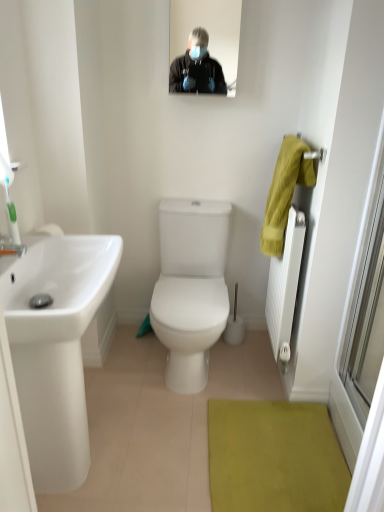
What is the approximate width of white glossy toilet at center?

It is 21.89 inches.

Where is `white glossy toilet at center`? This screenshot has height=512, width=384. white glossy toilet at center is located at coordinates (191, 288).

The width and height of the screenshot is (384, 512). Describe the element at coordinates (204, 46) in the screenshot. I see `matte black mirror at upper center` at that location.

You are a GUI agent. You are given a task and a screenshot of the screen. Output one action in this format:
    pyautogui.click(x=<x>, y=<y>)
    Task: Click on the green textured bath mat at lower center
    The width and height of the screenshot is (384, 512).
    Given the screenshot: What is the action you would take?
    pyautogui.click(x=274, y=457)

Which object is positioned more to the left, transparent glass door at right or white textured radiator at right?

white textured radiator at right.

Which point is more forward, (x=376, y=197) or (x=291, y=315)?

The point (x=376, y=197) is closer.

Can you confirm if transparent glass door at right is wider than white textured radiator at right?

No.

Is point (195, 335) positioned after point (78, 372)?

Yes, it is behind point (78, 372).

From a real-world perspective, does white glossy toilet at center sit lower than white glossy sink at left?

Yes.

Is the surface of white glossy toilet at center in direct contact with white glossy sink at left?

No, white glossy toilet at center is not making contact with white glossy sink at left.

From their relative heights in the image, would you say white glossy toilet at center is taller or shorter than white glossy sink at left?

white glossy toilet at center is shorter than white glossy sink at left.

Which of these two, transparent glass door at right or green textured bath mat at lower center, is wider?

green textured bath mat at lower center is wider.

From the image's perspective, which one is positioned lower, transparent glass door at right or green textured bath mat at lower center?

From the image's view, green textured bath mat at lower center is below.

Does point (373, 214) appear closer or farther from the camera than point (256, 442)?

Clearly, point (373, 214) is closer to the camera than point (256, 442).

From a real-world perspective, is transparent glass door at right positioned above or below green textured bath mat at lower center?

transparent glass door at right is above green textured bath mat at lower center.

From the picture: Is yellow fabric hand towel at right smaller than white glossy sink at left?

Yes.

Would you say yellow fabric hand towel at right is inside or outside white glossy sink at left?

yellow fabric hand towel at right is outside white glossy sink at left.

Considering the relative positions of yellow fabric hand towel at right and white glossy sink at left in the image provided, is yellow fabric hand towel at right to the left of white glossy sink at left from the viewer's perspective?

No.

Looking at their sizes, would you say yellow fabric hand towel at right is wider or thinner than white glossy sink at left?

yellow fabric hand towel at right is thinner than white glossy sink at left.

Is white glossy sink at left positioned beyond the bounds of white glossy toilet at center?

Indeed, white glossy sink at left is completely outside white glossy toilet at center.

Between white glossy sink at left and white glossy toilet at center, which one has more height?

Standing taller between the two is white glossy sink at left.

Is white glossy sink at left aimed at white glossy toilet at center?

No, white glossy sink at left is not turned towards white glossy toilet at center.

Identify the location of sink in front of the white glossy toilet at center. (56, 349).

From the image's perspective, would you say green textured bath mat at lower center is positioned over white glossy toilet at center?

No, from the image's perspective, green textured bath mat at lower center is not on top of white glossy toilet at center.

Which object is further away from the camera taking this photo, green textured bath mat at lower center or white glossy toilet at center?

white glossy toilet at center is more distant.

From a real-world perspective, who is located lower, green textured bath mat at lower center or white glossy toilet at center?

green textured bath mat at lower center is physically lower.

Does yellow fabric hand towel at right lie in front of transparent glass door at right?

No.

Between point (287, 178) and point (370, 342), which one is positioned behind?

The point (287, 178) is behind.

Considering the positions of objects yellow fabric hand towel at right and transparent glass door at right in the image provided, who is more to the right, yellow fabric hand towel at right or transparent glass door at right?

From the viewer's perspective, transparent glass door at right appears more on the right side.

Locate an element on the screen. This screenshot has height=512, width=384. radiator below the transparent glass door at right (from a real-world perspective) is located at coordinates (285, 282).

In the image, there is a white glossy toilet at center. Where is `sink below it (from the image's perspective)`? The width and height of the screenshot is (384, 512). sink below it (from the image's perspective) is located at coordinates (56, 349).

Looking at the image, which one is located closer to transparent glass door at right, white glossy toilet at center or matte black mirror at upper center?

Among the two, white glossy toilet at center is located nearer to transparent glass door at right.

When comparing their distances from white textured radiator at right, does white glossy toilet at center or matte black mirror at upper center seem further?

matte black mirror at upper center lies further to white textured radiator at right than the other object.

When comparing their distances from green textured bath mat at lower center, does yellow fabric hand towel at right or white glossy sink at left seem further?

Based on the image, yellow fabric hand towel at right appears to be further to green textured bath mat at lower center.

Considering their positions, is transparent glass door at right positioned closer to white glossy sink at left than yellow fabric hand towel at right?

yellow fabric hand towel at right is positioned closer to the anchor white glossy sink at left.

Which object lies nearer to the anchor point white glossy toilet at center, green textured bath mat at lower center or yellow fabric hand towel at right?

yellow fabric hand towel at right.

Looking at the image, which one is located closer to green textured bath mat at lower center, matte black mirror at upper center or transparent glass door at right?

transparent glass door at right lies closer to green textured bath mat at lower center than the other object.

When comparing their distances from transparent glass door at right, does matte black mirror at upper center or white glossy toilet at center seem closer?

white glossy toilet at center lies closer to transparent glass door at right than the other object.

Based on their spatial positions, is matte black mirror at upper center or white textured radiator at right further from white glossy toilet at center?

matte black mirror at upper center lies further to white glossy toilet at center than the other object.

The height and width of the screenshot is (512, 384). What are the coordinates of `window screen between matte black mirror at upper center and green textured bath mat at lower center from top to bottom` in the screenshot? It's located at (366, 314).

In order to click on hand towel that lies between matte black mirror at upper center and white textured radiator at right from top to bottom in this screenshot , I will do `click(284, 192)`.

Find the location of a particular element. radiator between yellow fabric hand towel at right and green textured bath mat at lower center from top to bottom is located at coordinates (285, 282).

This screenshot has height=512, width=384. I want to click on hand towel between matte black mirror at upper center and green textured bath mat at lower center in the up-down direction, so click(284, 192).